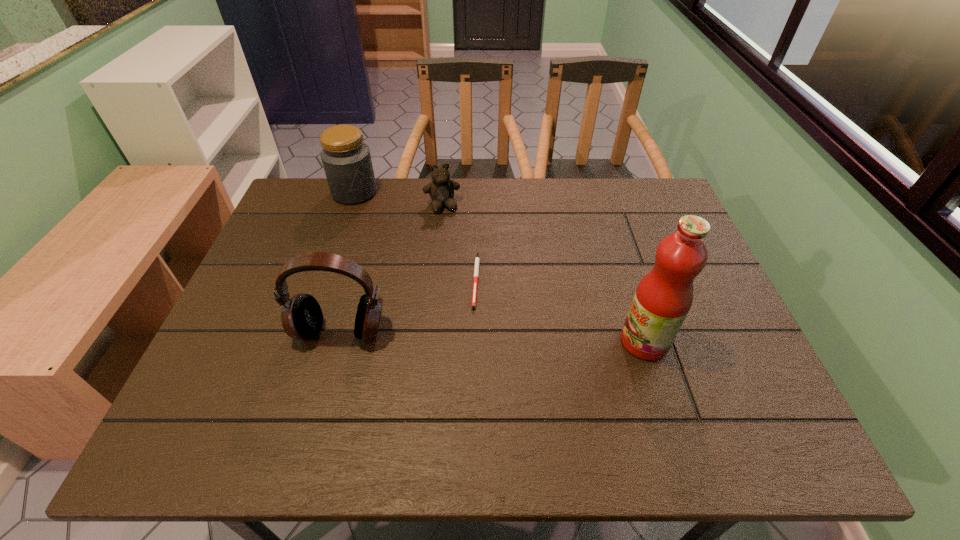
Where is `vacant space that is in between the third farthest object and the third object from right to left`? The width and height of the screenshot is (960, 540). vacant space that is in between the third farthest object and the third object from right to left is located at coordinates (459, 242).

Where is `empty space that is in between the fruit juice and the second object from right to left`? empty space that is in between the fruit juice and the second object from right to left is located at coordinates (561, 310).

Where is `empty space that is in between the third object from left to right and the tallest object`? empty space that is in between the third object from left to right and the tallest object is located at coordinates pos(543,273).

Locate an element on the screen. This screenshot has height=540, width=960. vacant area that lies between the teddy bear and the fruit juice is located at coordinates (543, 273).

At what (x,y) coordinates should I click in order to perform the action: click on unoccupied position between the jar and the tallest object. Please return your answer as a coordinate pair (x, y). The width and height of the screenshot is (960, 540). Looking at the image, I should click on (499, 267).

Where is `vacant area that lies between the fruit juice and the teddy bear`? This screenshot has width=960, height=540. vacant area that lies between the fruit juice and the teddy bear is located at coordinates (543, 273).

The width and height of the screenshot is (960, 540). In order to click on free space between the shortest object and the teddy bear in this screenshot , I will do point(459,242).

Image resolution: width=960 pixels, height=540 pixels. I want to click on vacant area that lies between the fourth tallest object and the headset, so click(x=392, y=268).

Where is `empty space between the fourth tallest object and the jar`? This screenshot has height=540, width=960. empty space between the fourth tallest object and the jar is located at coordinates (398, 199).

I want to click on object identified as the closest to the rightmost object, so click(476, 270).